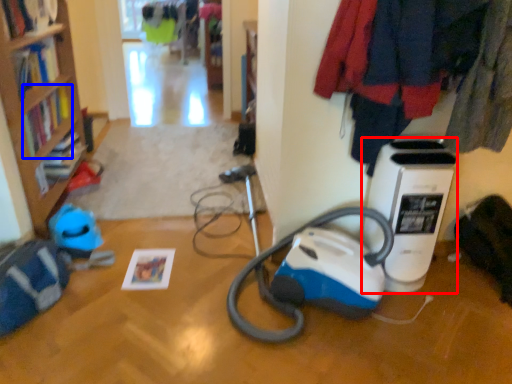
Question: Which point is further to the camera, home appliance (highlighted by a red box) or book (highlighted by a blue box)?

Choices:
 (A) home appliance
 (B) book

Answer: (B)